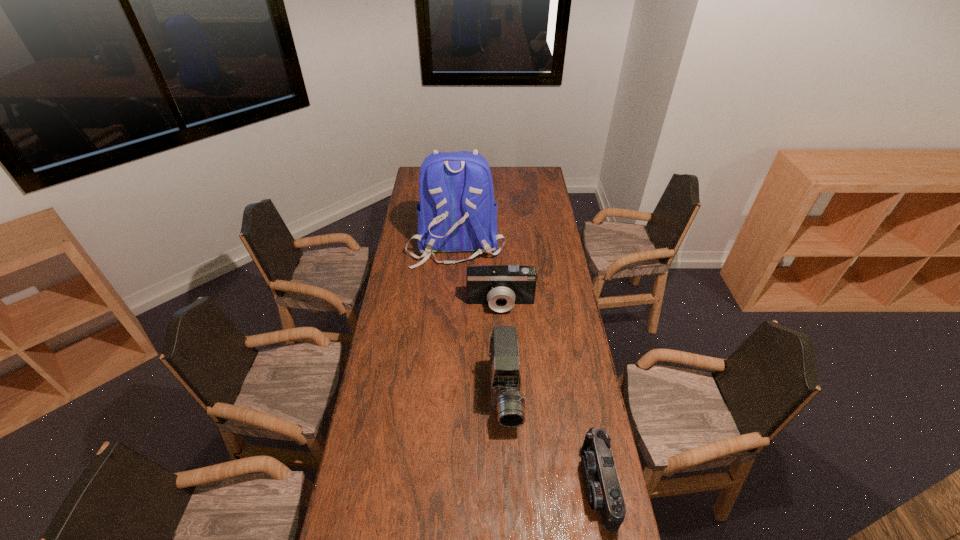
Locate an element on the screen. free space located on the lens of the third nearest object is located at coordinates (505, 396).

Find the location of `free region located 0.250m on the front-facing side of the rightmost object`. free region located 0.250m on the front-facing side of the rightmost object is located at coordinates pyautogui.click(x=501, y=485).

Locate an element on the screen. Image resolution: width=960 pixels, height=540 pixels. vacant space situated on the front-facing side of the rightmost object is located at coordinates (488, 485).

The width and height of the screenshot is (960, 540). Identify the location of free space located on the front-facing side of the rightmost object. point(455,485).

Identify the location of object present at the left edge. (457, 212).

You are a GUI agent. You are given a task and a screenshot of the screen. Output one action in this format:
    pyautogui.click(x=<x>, y=<y>)
    Task: Click on the object present at the right edge
    The width and height of the screenshot is (960, 540).
    Given the screenshot: What is the action you would take?
    pyautogui.click(x=603, y=490)

This screenshot has width=960, height=540. What are the coordinates of `blank area at the left edge` in the screenshot? It's located at (422, 284).

Locate an element on the screen. vacant space at the right edge is located at coordinates click(x=548, y=221).

Locate an element on the screen. The image size is (960, 540). unoccupied position between the farthest object and the third shortest object is located at coordinates (481, 320).

At what (x,y) coordinates should I click in order to perform the action: click on empty location between the second farthest camcorder and the farthest object. Please return your answer as a coordinate pair (x, y). This screenshot has width=960, height=540. Looking at the image, I should click on (481, 320).